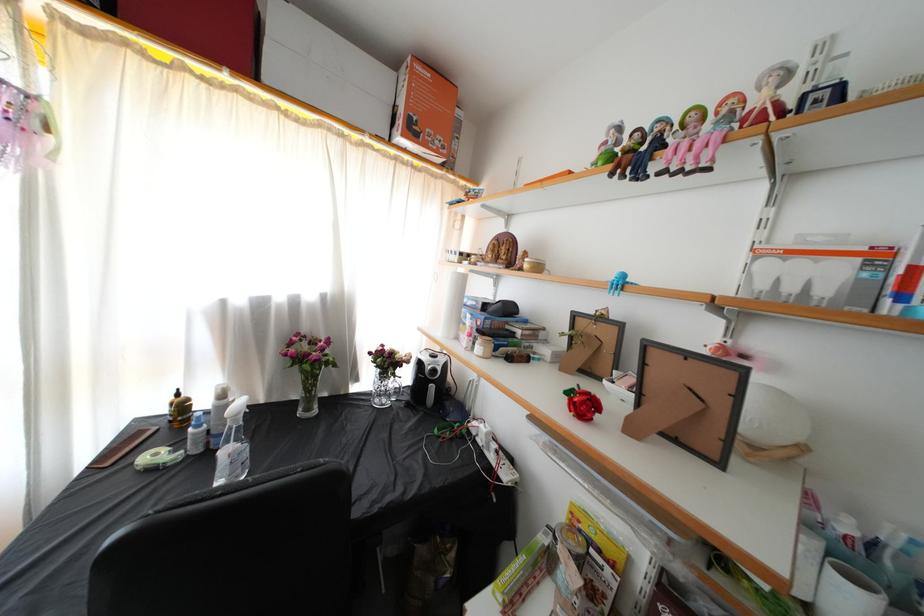
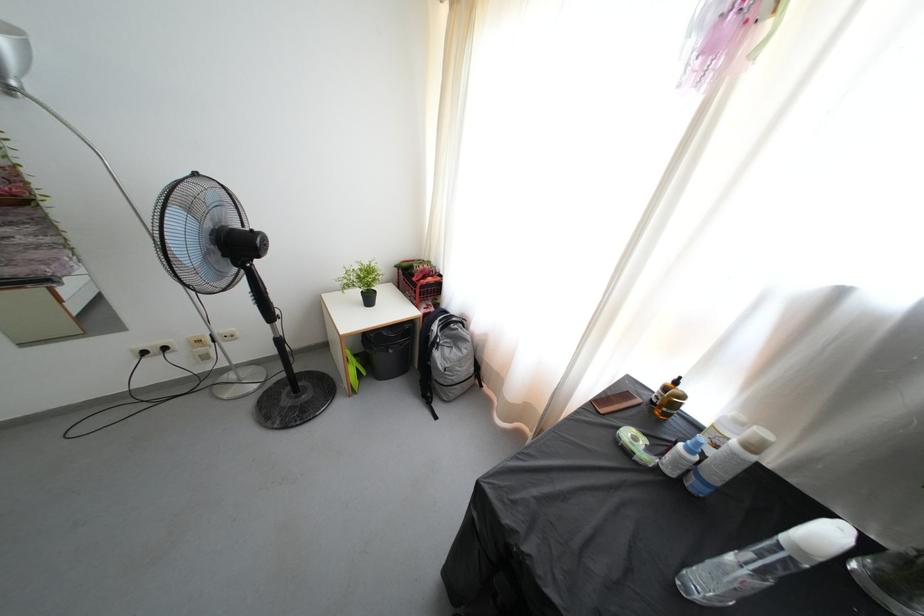
How did the camera likely rotate?

The camera rotated toward left-down.